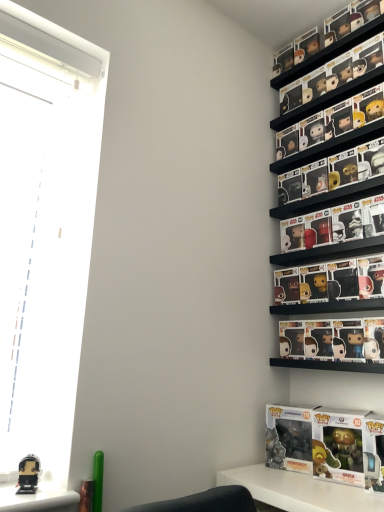
Find the location of a particular element. The height and width of the screenshot is (512, 384). matte black figurine at lower left is located at coordinates (28, 475).

Describe the element at coordinates (28, 475) in the screenshot. I see `matte black figurine at lower left` at that location.

Where is `matte black figurine at lower left`? matte black figurine at lower left is located at coordinates (28, 475).